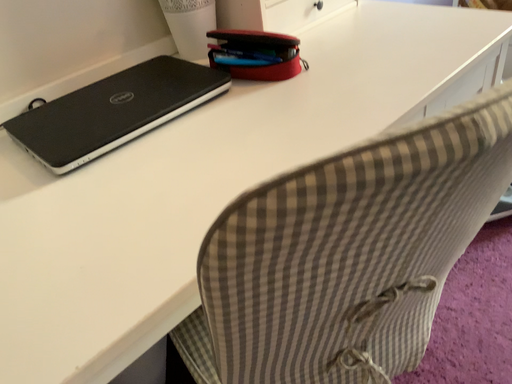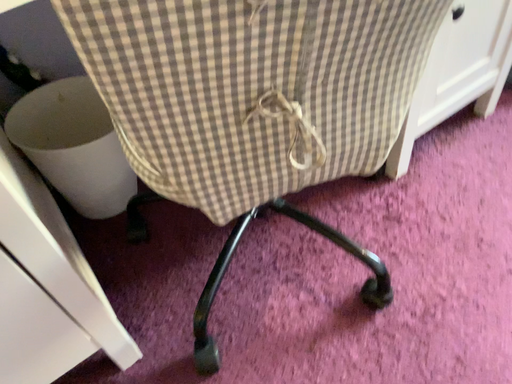
Question: How did the camera likely rotate when shooting the video?

Choices:
 (A) rotated upward
 (B) rotated downward

Answer: (B)